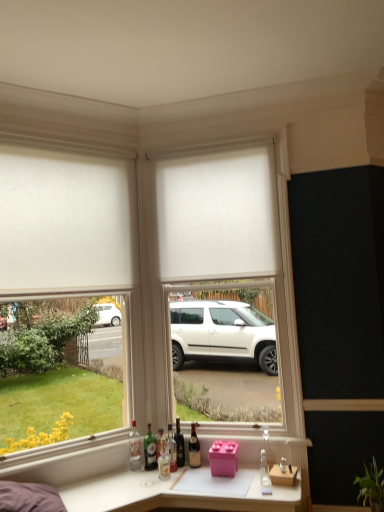
Locate an element on the screen. free space in front of translucent glass bottle at center, acting as the 4th bottle starting from the right is located at coordinates (172, 481).